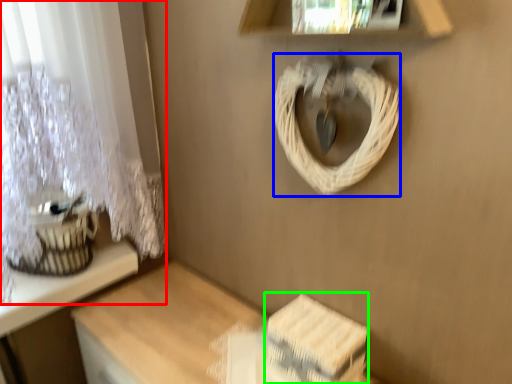
Question: Which is farther away from curtain (highlighted by a red box)? rope (highlighted by a blue box) or storage box (highlighted by a green box)?

Choices:
 (A) rope
 (B) storage box

Answer: (B)